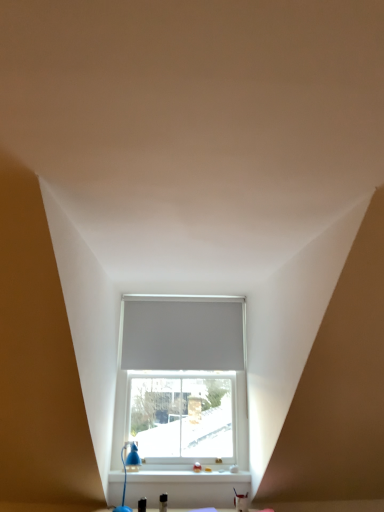
Question: Does point pyautogui.click(x=180, y=480) appear closer or farther from the camera than point pyautogui.click(x=236, y=302)?

Choices:
 (A) closer
 (B) farther

Answer: (A)

Question: From a real-world perspective, is white plastic window sill at lower center above or below white matte window at center?

Choices:
 (A) above
 (B) below

Answer: (B)

Question: Based on their relative distances, which object is nearer to the blue plastic table lamp at lower left?

Choices:
 (A) white matte window at center
 (B) white matte blind at center
 (C) white plastic window sill at lower center

Answer: (C)

Question: Estimate the real-world distances between objects in this image. Which object is farther from the blue plastic table lamp at lower left?

Choices:
 (A) white matte blind at center
 (B) white matte window at center
 (C) white plastic window sill at lower center

Answer: (A)